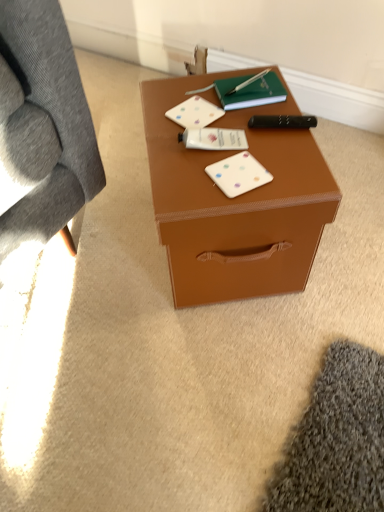
Locate an element on the screen. This screenshot has height=512, width=384. free spot to the right of white matte card game at center, which is counted as the 1th card game, starting from the top is located at coordinates (263, 126).